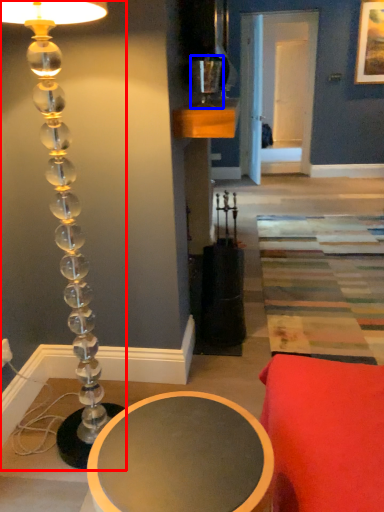
Question: Among these objects, which one is farthest to the camera, lamp (highlighted by a red box) or candle holder (highlighted by a blue box)?

Choices:
 (A) lamp
 (B) candle holder

Answer: (B)